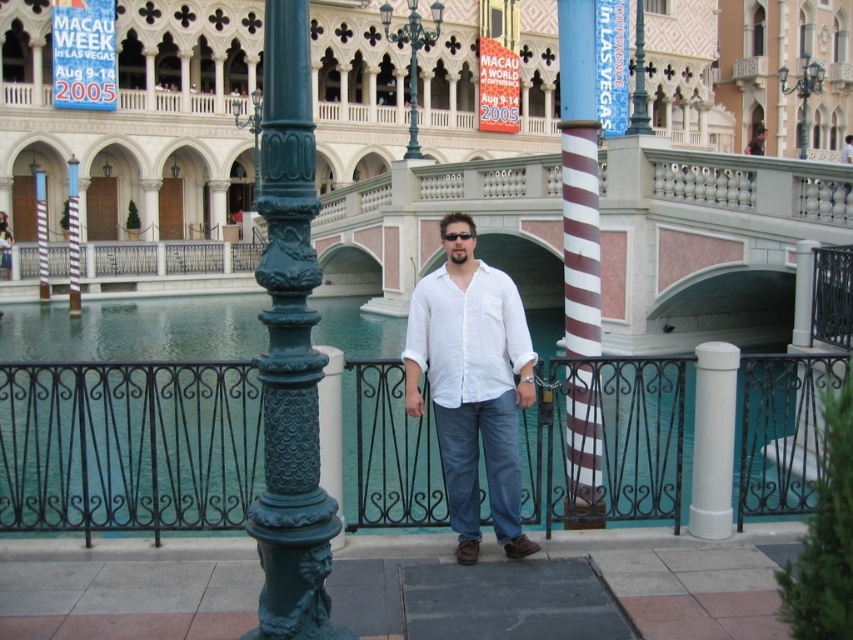
Between point (596, 300) and point (321, 444), which one is positioned in front?

Point (321, 444) is in front.

Can you confirm if white striped pole at center is thinner than green ornate pole at center?

Incorrect, white striped pole at center's width is not less than green ornate pole at center's.

The height and width of the screenshot is (640, 853). What do you see at coordinates (579, 177) in the screenshot?
I see `white striped pole at center` at bounding box center [579, 177].

Where is `white striped pole at center`? The height and width of the screenshot is (640, 853). white striped pole at center is located at coordinates (579, 177).

Between white cotton shirt at center and blue fabric banner at upper center, which one is positioned lower?

white cotton shirt at center is below.

Which is behind, point (495, 305) or point (611, 22)?

Point (611, 22)

Identify the location of white cotton shirt at center. (473, 384).

Based on the photo, is white marble palace at center in front of green cast iron lamp post at center?

That is True.

Does point (657, 35) lie behind point (248, 129)?

Yes.

Locate an element on the screen. white marble palace at center is located at coordinates (134, 120).